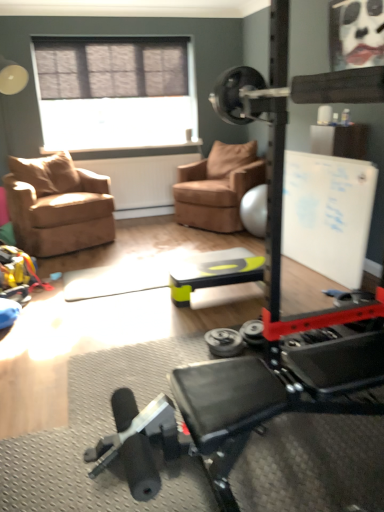
Question: In terms of width, does matte black face at upper right look wider or thinner when compared to suede brown armchair at center, the first chair positioned from the right?

Choices:
 (A) wide
 (B) thin

Answer: (B)

Question: From the image's perspective, relative to suede brown armchair at center, which is counted as the 2th chair, starting from the left, is matte black face at upper right above or below?

Choices:
 (A) above
 (B) below

Answer: (A)

Question: Which object is the closest to the silver metallic dumbbell at center?

Choices:
 (A) white matte bulletin board at upper right
 (B) suede brown armchair at left, which appears as the second chair when viewed from the right
 (C) green plastic table at center
 (D) matte gray window at upper center
 (E) matte black face at upper right

Answer: (C)

Question: Which of these objects is positioned closest to the matte black face at upper right?

Choices:
 (A) matte gray window at upper center
 (B) silver metallic dumbbell at center
 (C) suede brown armchair at center, which is counted as the 2th chair, starting from the left
 (D) green plastic table at center
 (E) suede brown armchair at left, which appears as the second chair when viewed from the right

Answer: (D)